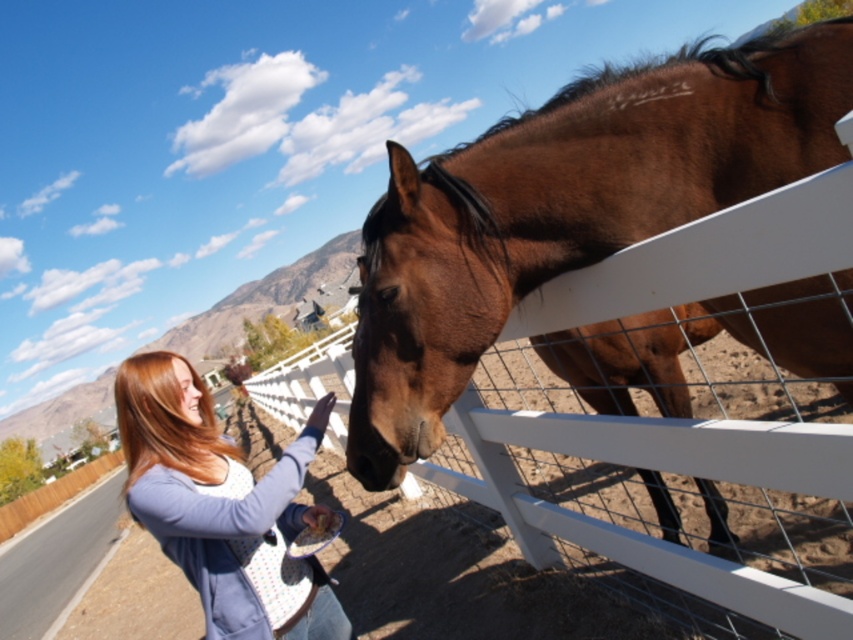
You are standing in the field and see the brown glossy horse at center and the matte blue sweater at lower left. Which object is positioned to the right side?

The brown glossy horse at center is positioned to the right of the matte blue sweater at lower left.

You are standing in the field and see the brown glossy horse at center and the matte blue sweater at lower left. Which object is higher up in the image?

The brown glossy horse at center is located above the matte blue sweater at lower left, so the brown glossy horse at center is higher up in the image.